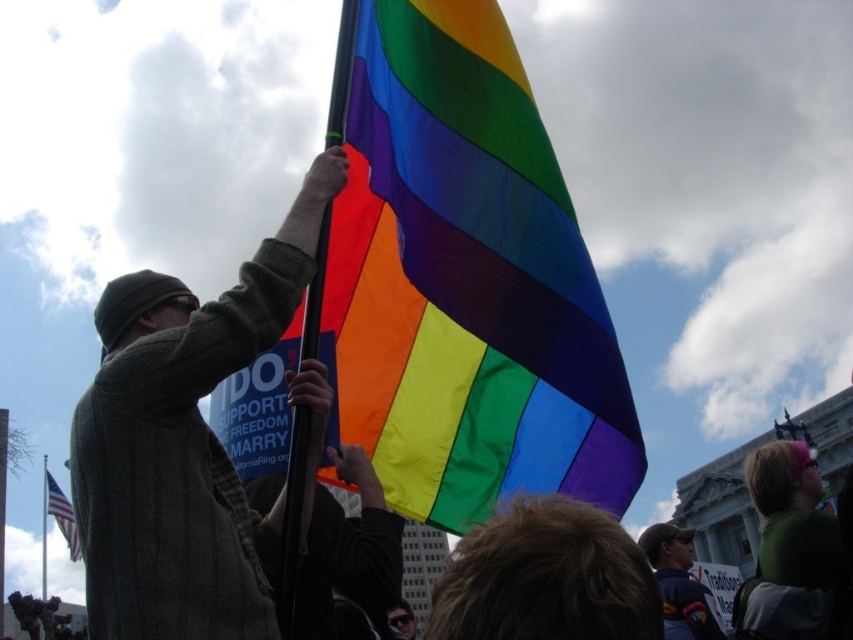
You are a photographer at the rally and want to capture a photo that includes both the dark blue baseball cap at lower right and the american flag at lower left. Based on their positions, which object should you adjust your camera angle to focus on first to ensure both are in the frame?

The dark blue baseball cap at lower right is above the american flag at lower left, so you should adjust your camera angle to focus on the dark blue baseball cap at lower right first to ensure both are in the frame.

You are a photographer at the rally and want to capture a photo that includes both the rainbow fabric flag at center and the knit green sweater at center. The camera you are using has a maximum focus range of 30 feet. Can you fit both objects in the frame without moving closer?

The rainbow fabric flag at center and the knit green sweater at center are 32.02 feet apart, which exceeds the camera maximum focus range of 30 feet. Therefore, you cannot fit both objects in the frame without moving closer.